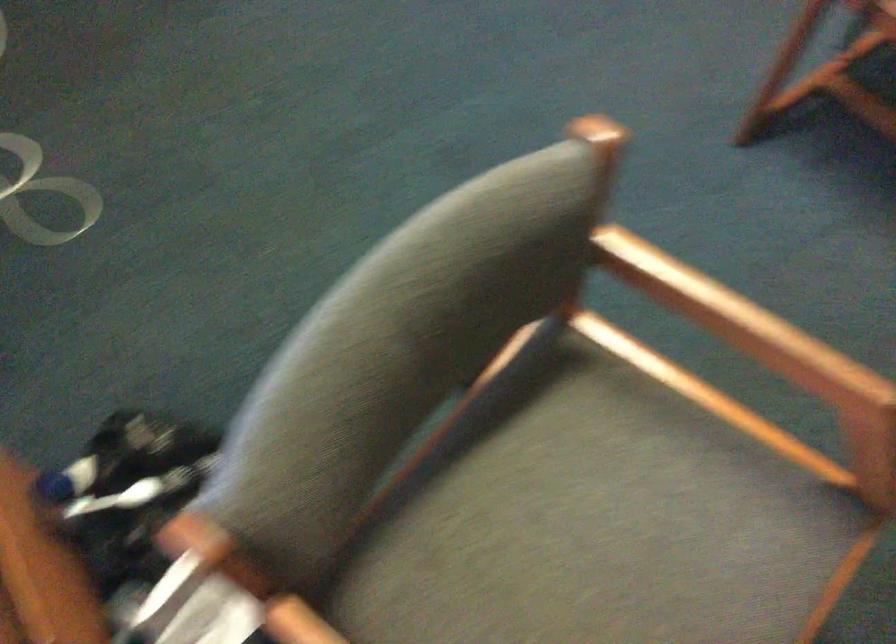
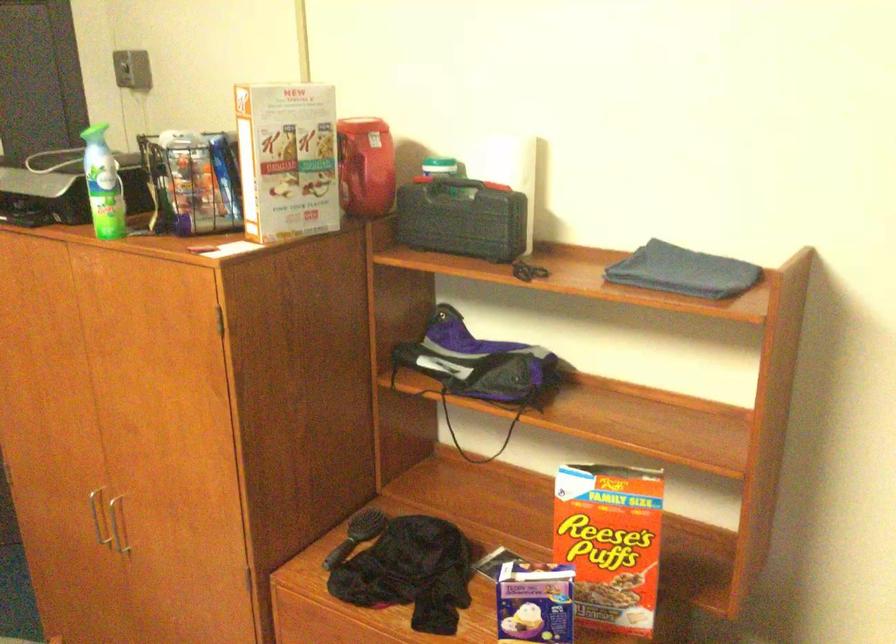
Question: The camera is either moving clockwise (left) or counter-clockwise (right) around the object. The first image is from the beginning of the video and the second image is from the end. Is the camera moving left or right when shooting the video?

Choices:
 (A) Left
 (B) Right

Answer: (A)